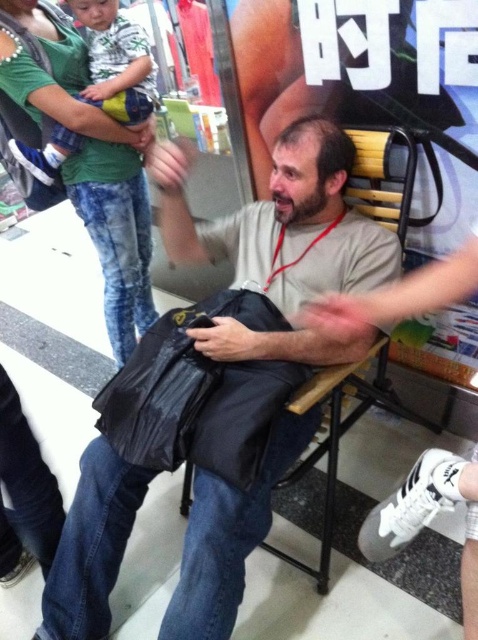
Question: Which point appears closest to the camera in this image?

Choices:
 (A) (218, 554)
 (B) (239, 376)

Answer: (A)

Question: Does matte black bag at center appear over black matte bag at center?

Choices:
 (A) no
 (B) yes

Answer: (A)

Question: Is matte black bag at center thinner than black matte bag at center?

Choices:
 (A) yes
 (B) no

Answer: (B)

Question: Which object appears closest to the camera in this image?

Choices:
 (A) black matte bag at center
 (B) matte black bag at center

Answer: (B)

Question: Which of the following is the closest to the observer?

Choices:
 (A) black matte bag at center
 (B) matte black bag at center

Answer: (B)

Question: Considering the relative positions of matte black bag at center and black matte bag at center in the image provided, where is matte black bag at center located with respect to black matte bag at center?

Choices:
 (A) above
 (B) below

Answer: (B)